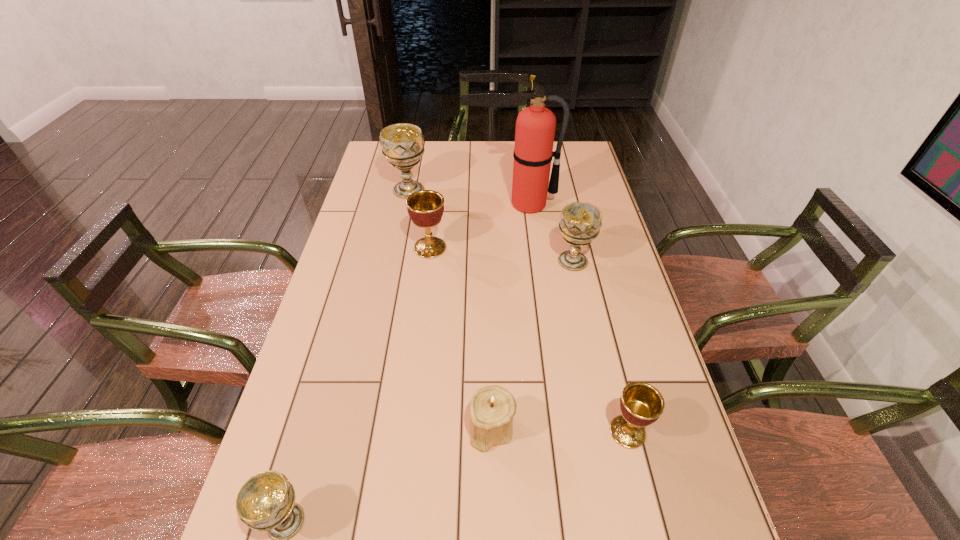
Where is `vacant space at the left edge of the desktop`? The image size is (960, 540). vacant space at the left edge of the desktop is located at coordinates (371, 189).

In the image, there is a desktop. At what (x,y) coordinates should I click in order to perform the action: click on vacant space at the right edge. Please return your answer as a coordinate pair (x, y). The image size is (960, 540). Looking at the image, I should click on (690, 533).

The width and height of the screenshot is (960, 540). I want to click on vacant point located between the biggest white chalice and the red fire extinguisher, so click(469, 197).

The width and height of the screenshot is (960, 540). I want to click on free spot between the tallest chalice and the second nearest white chalice, so click(491, 225).

Choose which object is the nearest neighbor to the candle_holder. Please provide its 2D coordinates. Your answer should be formatted as a tuple, i.e. [(x, y)], where the tuple contains the x and y coordinates of a point satisfying the conditions above.

[(641, 404)]

I want to click on object that is the fourth closest one to the beige candle_holder, so click(x=425, y=207).

Identify which chalice is located as the nearest to the fourth object from left to right. Please provide its 2D coordinates. Your answer should be formatted as a tuple, i.e. [(x, y)], where the tuple contains the x and y coordinates of a point satisfying the conditions above.

[(641, 404)]

Identify which chalice is the second nearest to the nearer golden chalice. Please provide its 2D coordinates. Your answer should be formatted as a tuple, i.e. [(x, y)], where the tuple contains the x and y coordinates of a point satisfying the conditions above.

[(266, 502)]

In order to click on white chalice that is the second closest to the nearest object in this screenshot , I will do `click(402, 144)`.

Locate an element on the screen. The height and width of the screenshot is (540, 960). the second closest white chalice relative to the red fire extinguisher is located at coordinates (402, 144).